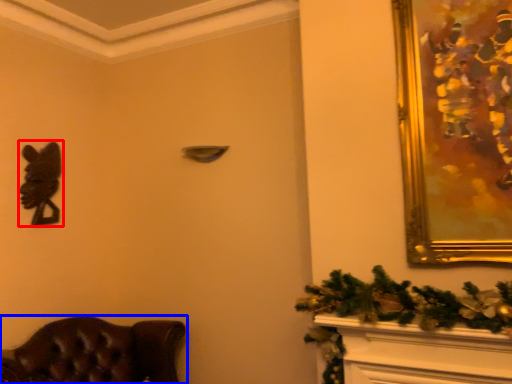
Question: Which object appears closest to the camera in this image, animal (highlighted by a red box) or furniture (highlighted by a blue box)?

Choices:
 (A) animal
 (B) furniture

Answer: (B)